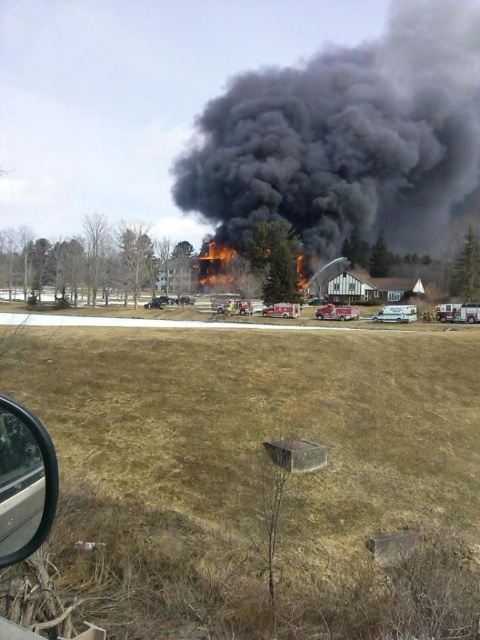
Can you confirm if brown grass at center is positioned above red metallic fire truck at center?

Incorrect, brown grass at center is not positioned above red metallic fire truck at center.

Does brown grass at center have a greater height compared to red metallic fire truck at center?

Yes, brown grass at center is taller than red metallic fire truck at center.

This screenshot has height=640, width=480. Identify the location of brown grass at center. (257, 476).

Describe the element at coordinates (257, 476) in the screenshot. The width and height of the screenshot is (480, 640). I see `brown grass at center` at that location.

How far apart are brown grass at center and white matte van at center?

brown grass at center and white matte van at center are 38.62 meters apart.

Between point (72, 536) and point (397, 310), which one is positioned in front?

Positioned in front is point (72, 536).

Find the location of `brown grass at center`. brown grass at center is located at coordinates pyautogui.click(x=257, y=476).

Does brown grass at center appear over black smoke at upper center?

No.

Between brown grass at center and black smoke at upper center, which one has more height?

black smoke at upper center is taller.

Which is behind, point (409, 612) or point (205, 200)?

Positioned behind is point (205, 200).

Where is `brown grass at center`? brown grass at center is located at coordinates (257, 476).